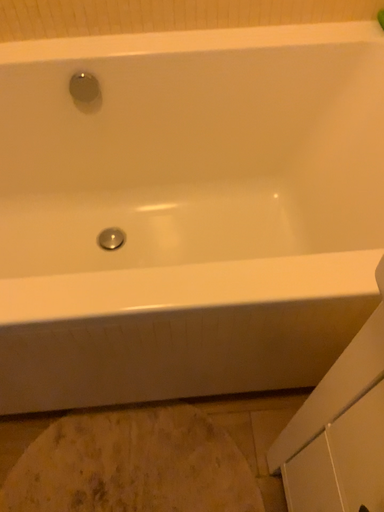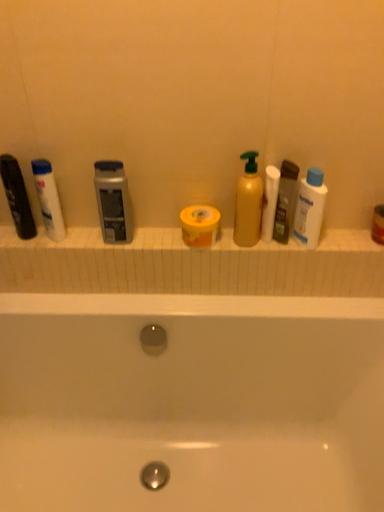
Question: Which way did the camera rotate in the video?

Choices:
 (A) rotated downward
 (B) rotated upward

Answer: (B)